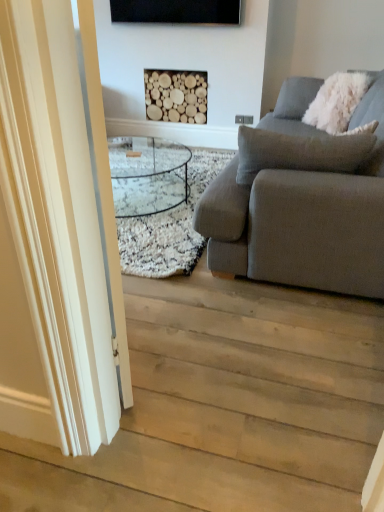
Question: Is light wood floor at lower left to the right of natural wood logs at upper center from the viewer's perspective?

Choices:
 (A) yes
 (B) no

Answer: (A)

Question: Does light wood floor at lower left have a greater height compared to natural wood logs at upper center?

Choices:
 (A) no
 (B) yes

Answer: (A)

Question: From a real-world perspective, is light wood floor at lower left located beneath natural wood logs at upper center?

Choices:
 (A) no
 (B) yes

Answer: (B)

Question: Is light wood floor at lower left outside of natural wood logs at upper center?

Choices:
 (A) no
 (B) yes

Answer: (B)

Question: Is light wood floor at lower left closer to camera compared to natural wood logs at upper center?

Choices:
 (A) no
 (B) yes

Answer: (B)

Question: Can you confirm if light wood floor at lower left is thinner than natural wood logs at upper center?

Choices:
 (A) yes
 (B) no

Answer: (B)

Question: From the image's perspective, is natural wood logs at upper center over gray fabric couch at right?

Choices:
 (A) no
 (B) yes

Answer: (B)

Question: Is natural wood logs at upper center positioned behind gray fabric couch at right?

Choices:
 (A) yes
 (B) no

Answer: (A)

Question: Considering the relative sizes of natural wood logs at upper center and gray fabric couch at right in the image provided, is natural wood logs at upper center shorter than gray fabric couch at right?

Choices:
 (A) no
 (B) yes

Answer: (B)

Question: Is gray fabric couch at right located within natural wood logs at upper center?

Choices:
 (A) no
 (B) yes

Answer: (A)

Question: Is natural wood logs at upper center at the right side of gray fabric couch at right?

Choices:
 (A) yes
 (B) no

Answer: (B)

Question: Is gray fabric couch at right at the back of natural wood logs at upper center?

Choices:
 (A) yes
 (B) no

Answer: (B)

Question: Is white glossy door at left wider than light wood floor at lower left?

Choices:
 (A) no
 (B) yes

Answer: (A)